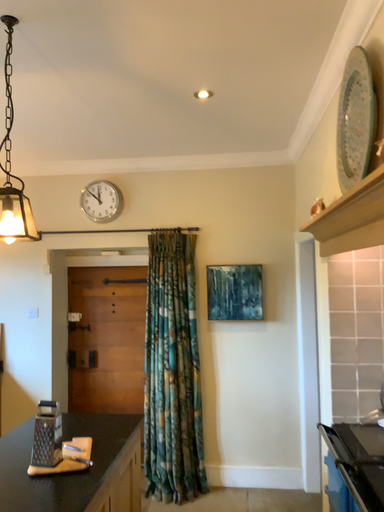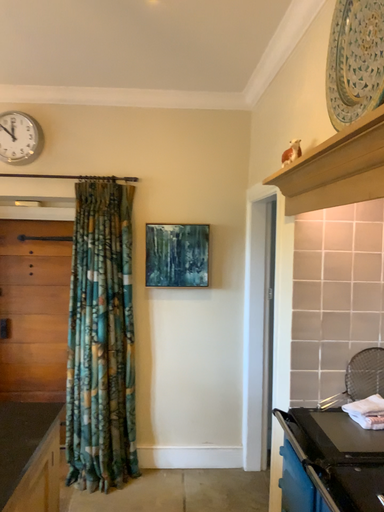
Question: Which way did the camera rotate in the video?

Choices:
 (A) rotated right
 (B) rotated left

Answer: (A)